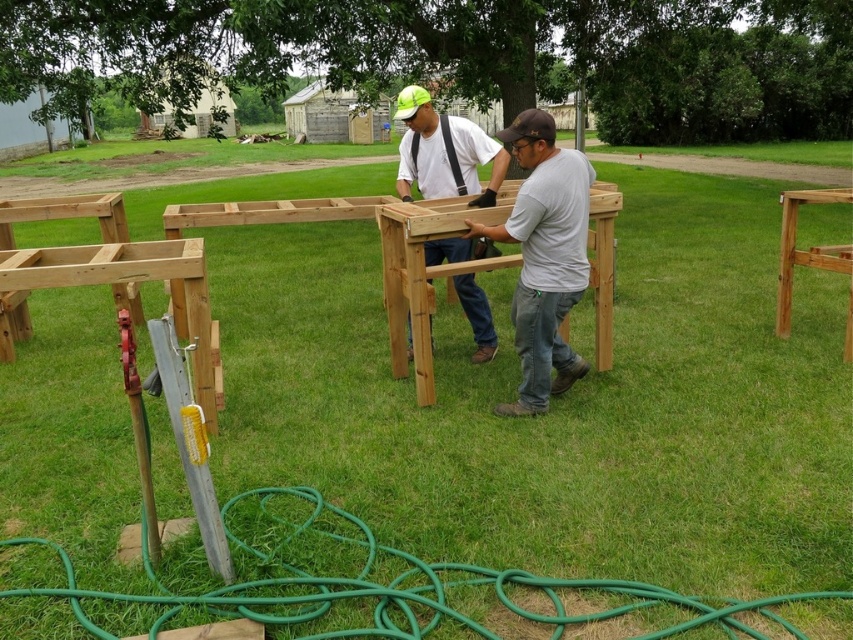
Question: Which point is closer to the camera?

Choices:
 (A) matte wood construction at center
 (B) natural wood frame at center

Answer: (B)

Question: Among these objects, which one is farthest from the camera?

Choices:
 (A) light brown wood at right
 (B) natural wood frame at center
 (C) natural wood frame at left

Answer: (A)

Question: Is matte wood construction at center closer to the viewer compared to light brown wood at right?

Choices:
 (A) no
 (B) yes

Answer: (B)

Question: Is the position of green rubber hose at lower center more distant than that of gray matte shirt at center?

Choices:
 (A) yes
 (B) no

Answer: (B)

Question: Where is green rubber hose at lower center located in relation to natural wood frame at center in the image?

Choices:
 (A) left
 (B) right

Answer: (A)

Question: Which of the following is the closest to the observer?

Choices:
 (A) (389, 282)
 (B) (57, 268)

Answer: (B)